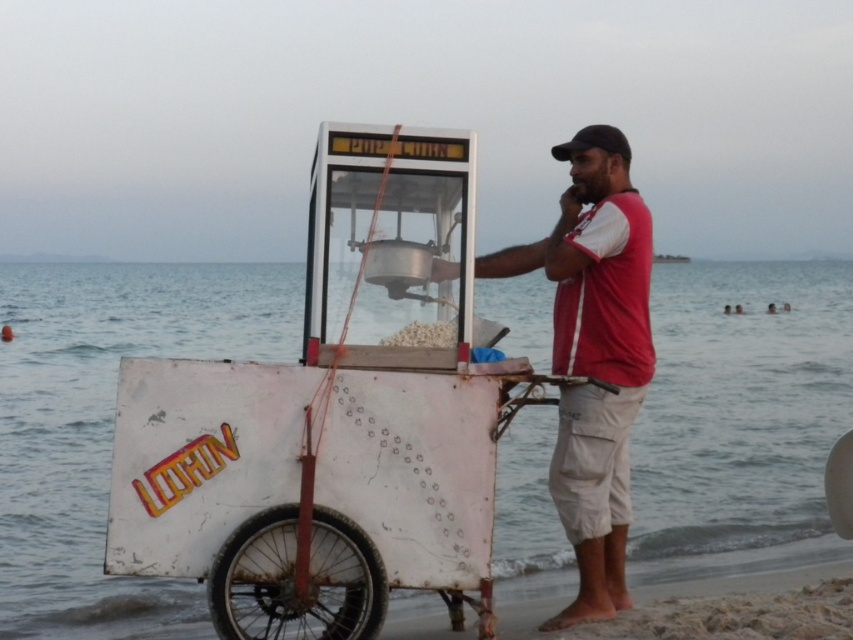
Between white matte popcorn cart at center and red cotton t-shirt at center, which one has less height?

With less height is white matte popcorn cart at center.

Can you confirm if white matte popcorn cart at center is positioned to the right of red cotton t-shirt at center?

In fact, white matte popcorn cart at center is to the left of red cotton t-shirt at center.

From the picture: Who is more forward, (270,426) or (576,284)?

Point (270,426)

Find the location of `white matte popcorn cart at center`. white matte popcorn cart at center is located at coordinates (335, 417).